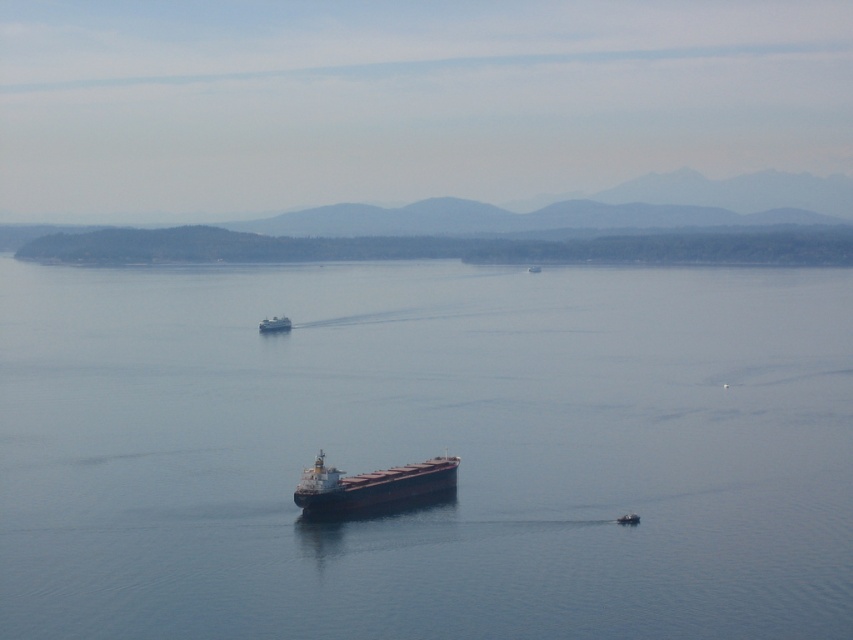
You are a sailor on the metallic gray ship at center and need to navigate through the dark blue water at center. Which direction should you steer to move towards the water?

The dark blue water at center is positioned on the left side of the metallic gray ship at center, so you should steer left to move towards the water.